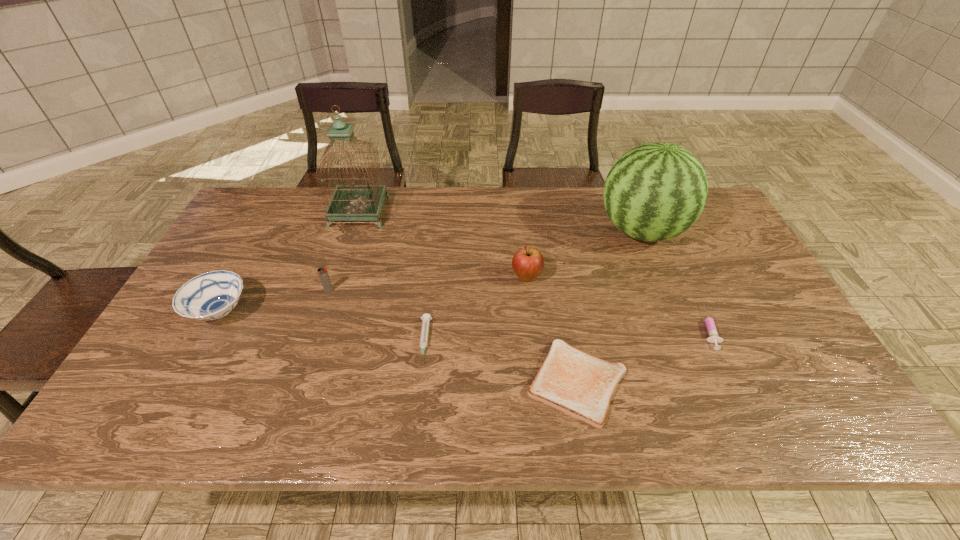
Where is `object that is at the left edge`? object that is at the left edge is located at coordinates (212, 295).

The image size is (960, 540). I want to click on object that is positioned at the right edge, so click(x=654, y=192).

The width and height of the screenshot is (960, 540). Find the location of `object located in the far right corner section of the desktop`. object located in the far right corner section of the desktop is located at coordinates (654, 192).

In the image, there is a desktop. Identify the location of free space at the far edge. (395, 228).

Locate an element on the screen. The height and width of the screenshot is (540, 960). vacant area at the right edge is located at coordinates (723, 302).

This screenshot has width=960, height=540. Identify the location of free spot at the far left corner of the desktop. (283, 195).

Locate an element on the screen. The image size is (960, 540). empty location between the left syringe and the toast is located at coordinates (501, 362).

Image resolution: width=960 pixels, height=540 pixels. I want to click on unoccupied area between the left syringe and the birdcage, so [x=392, y=276].

Identify the location of empty space that is in between the leftmost object and the shortest object. (398, 347).

Find the location of `free space between the right syringe and the watermelon`. free space between the right syringe and the watermelon is located at coordinates (674, 279).